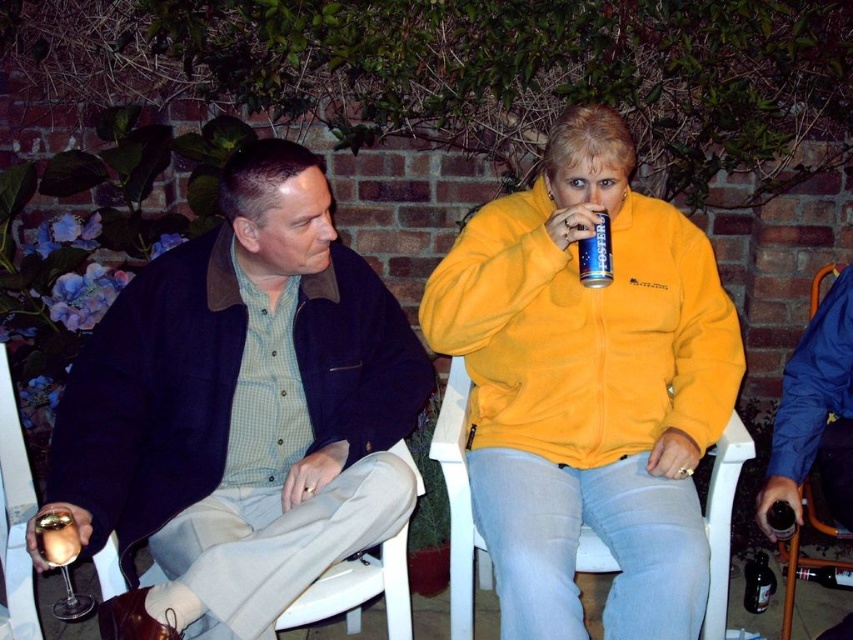
Question: Can you confirm if metallic gold ring at lower left is thinner than blue metallic can at upper center?

Choices:
 (A) no
 (B) yes

Answer: (A)

Question: Can you confirm if white plastic chair at lower center is thinner than blue metallic can at upper center?

Choices:
 (A) no
 (B) yes

Answer: (A)

Question: Is matte blue jacket at center above white plastic chair at lower center?

Choices:
 (A) yes
 (B) no

Answer: (A)

Question: Which object appears closest to the camera in this image?

Choices:
 (A) yellow fleece jacket at center
 (B) metallic gold ring at lower left
 (C) white plastic chair at center

Answer: (B)

Question: Which of the following is the closest to the observer?

Choices:
 (A) (70, 550)
 (B) (302, 392)

Answer: (A)

Question: Among these objects, which one is farthest from the camera?

Choices:
 (A) blue metallic can at upper center
 (B) matte blue jacket at center
 (C) metallic gold ring at lower left
 (D) yellow fleece jacket at center

Answer: (D)